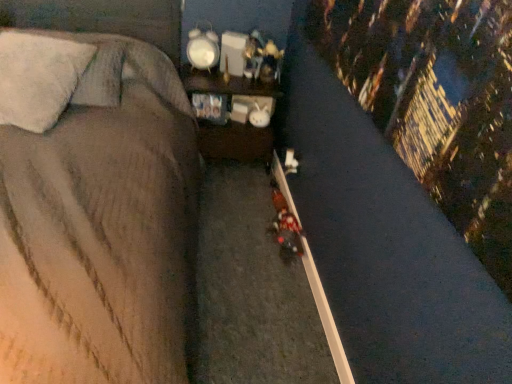
Question: Does soft gray fabric bed at center appear on the right side of wooden shelf at center?

Choices:
 (A) yes
 (B) no

Answer: (B)

Question: From a real-world perspective, is soft gray fabric bed at center over wooden shelf at center?

Choices:
 (A) yes
 (B) no

Answer: (A)

Question: Is soft gray fabric bed at center at the left side of wooden shelf at center?

Choices:
 (A) yes
 (B) no

Answer: (A)

Question: Could wooden shelf at center be considered to be inside soft gray fabric bed at center?

Choices:
 (A) yes
 (B) no

Answer: (B)

Question: Is soft gray fabric bed at center closer to camera compared to wooden shelf at center?

Choices:
 (A) yes
 (B) no

Answer: (A)

Question: Is soft gray fabric bed at center located outside wooden shelf at center?

Choices:
 (A) yes
 (B) no

Answer: (A)

Question: Can you confirm if shiny plastic toy at center is taller than white fluffy pillow at upper left?

Choices:
 (A) yes
 (B) no

Answer: (B)

Question: Does shiny plastic toy at center come in front of white fluffy pillow at upper left?

Choices:
 (A) no
 (B) yes

Answer: (A)

Question: Is shiny plastic toy at center looking in the opposite direction of white fluffy pillow at upper left?

Choices:
 (A) no
 (B) yes

Answer: (A)

Question: Considering the relative positions of shiny plastic toy at center and white fluffy pillow at upper left in the image provided, is shiny plastic toy at center to the left of white fluffy pillow at upper left from the viewer's perspective?

Choices:
 (A) yes
 (B) no

Answer: (B)

Question: From the image's perspective, does shiny plastic toy at center appear higher than white fluffy pillow at upper left?

Choices:
 (A) no
 (B) yes

Answer: (B)

Question: From a real-world perspective, is shiny plastic toy at center on white fluffy pillow at upper left?

Choices:
 (A) no
 (B) yes

Answer: (B)

Question: Is soft gray fabric bed at center oriented towards white fluffy pillow at upper left?

Choices:
 (A) no
 (B) yes

Answer: (A)